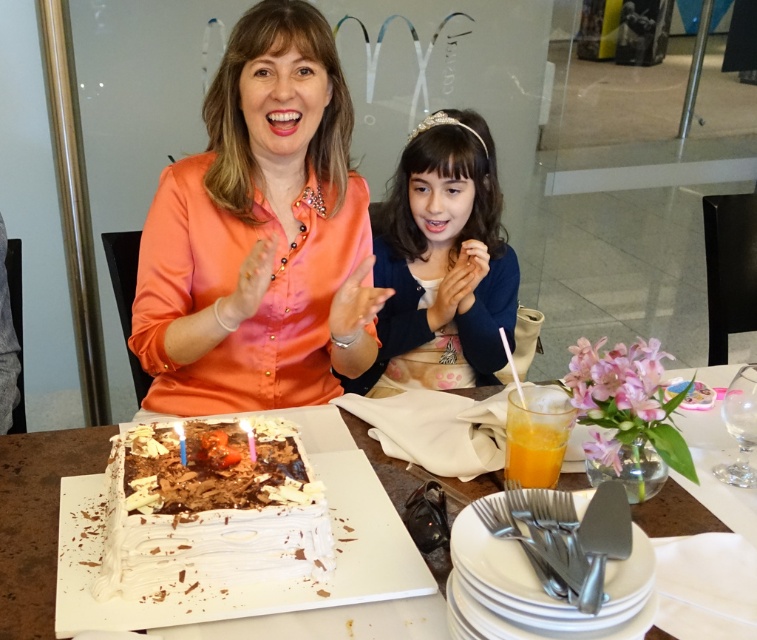
Consider the image. You are a photographer at the birthday celebration. You need to take a photo that includes both the orange satin blouse at upper left and the matte blue sweater at center. Which one should you focus on first to ensure both are in the frame?

The orange satin blouse at upper left is located above the matte blue sweater at center, so you should focus on the orange satin blouse at upper left first to ensure both are in the frame.

You are a photographer standing at the entrance of the McDonald restaurant. You want to take a photo of the birthday cake on the table. Which object from the following list is located at the center of the scene? matte blue sweater at center, stack of white plates

The matte blue sweater at center is located at the center of the scene according to the coordinates provided in the Objects Description.

In the scene shown: You are a birthday guest at McDonalds and want to place the translucent glass cup at lower right on the table without it tipping over. Considering the orange satin blouse at upper left is in the way, can you move the blouse to make space?

The orange satin blouse at upper left is larger than the translucent glass cup at lower right, so moving it might require more effort but it is possible to create space for the cup.